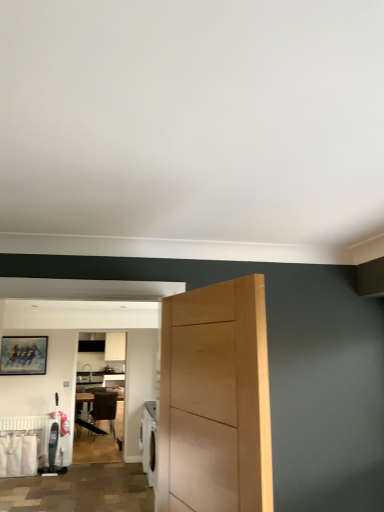
This screenshot has height=512, width=384. What do you see at coordinates (29, 428) in the screenshot?
I see `white matte radiator at lower left` at bounding box center [29, 428].

Where is `wooden table at center`? This screenshot has width=384, height=512. wooden table at center is located at coordinates (100, 409).

This screenshot has width=384, height=512. What do you see at coordinates (216, 399) in the screenshot?
I see `light wood door at center` at bounding box center [216, 399].

Looking at this image, measure the distance between point [106,402] and camera.

The depth of point [106,402] is 7.44 meters.

The width and height of the screenshot is (384, 512). What do you see at coordinates (105, 407) in the screenshot? I see `wooden chair at center` at bounding box center [105, 407].

The image size is (384, 512). Find the location of `white matte radiator at lower left`. white matte radiator at lower left is located at coordinates (29, 428).

Is wooden chair at center facing away from wooden table at center?

Yes, wooden chair at center's orientation is away from wooden table at center.

From the picture: Is wooden chair at center with wooden table at center?

Yes, wooden chair at center is with wooden table at center.

From a real-world perspective, which object stands above the other?

From a 3D spatial view, wooden chair at center is above.

Which object is positioned more to the left, light wood door at center or wooden chair at center?

Positioned to the left is wooden chair at center.

Is light wood door at center positioned beyond the bounds of wooden chair at center?

Yes, light wood door at center is outside of wooden chair at center.

Can you tell me how much light wood door at center and wooden chair at center differ in facing direction?

101 degrees.

From the picture: Is light wood door at center with wooden chair at center?

A: No, light wood door at center is not next to wooden chair at center.

Which of these two, wooden chair at center or white matte radiator at lower left, is thinner?

With smaller width is white matte radiator at lower left.

Which point is more distant from viewer, (x=103, y=411) or (x=47, y=434)?

The point (x=103, y=411) is farther.

Between wooden chair at center and white matte radiator at lower left, which one has larger size?

wooden chair at center.

Does white matte radiator at lower left have a lesser width compared to wooden table at center?

Indeed, white matte radiator at lower left has a lesser width compared to wooden table at center.

From a real-world perspective, which is physically above, white matte radiator at lower left or wooden table at center?

white matte radiator at lower left is physically above.

Which object is positioned more to the right, white matte radiator at lower left or wooden table at center?

wooden table at center.

At what (x,y) coordinates should I click in order to perform the action: click on table below the white matte radiator at lower left (from a real-world perspective). Please return your answer as a coordinate pair (x, y). Looking at the image, I should click on (100, 409).

Image resolution: width=384 pixels, height=512 pixels. In order to click on door on the right of white matte radiator at lower left in this screenshot , I will do `click(216, 399)`.

Is light wood door at center bigger than white matte radiator at lower left?

Yes, light wood door at center is bigger than white matte radiator at lower left.

Considering the positions of points (206, 425) and (11, 417), is point (206, 425) closer to camera compared to point (11, 417)?

That is True.

From the image's perspective, who appears lower, wooden table at center or white matte radiator at lower left?

wooden table at center is shown below in the image.

Is wooden table at center situated inside white matte radiator at lower left or outside?

wooden table at center exists outside the volume of white matte radiator at lower left.

What's the angular difference between wooden table at center and white matte radiator at lower left's facing directions?

wooden table at center and white matte radiator at lower left are facing 3.27 degrees away from each other.

Between wooden table at center and white matte radiator at lower left, which one is positioned in front?

white matte radiator at lower left is in front.

Is white matte radiator at lower left turned away from light wood door at center?

No, white matte radiator at lower left is not facing away from light wood door at center.

From the image's perspective, is white matte radiator at lower left located beneath light wood door at center?

Indeed, from the image's perspective, white matte radiator at lower left is shown beneath light wood door at center.

Is white matte radiator at lower left at the left side of light wood door at center?

Yes.

Find the location of a particular element. table behind the wooden chair at center is located at coordinates (100, 409).

Image resolution: width=384 pixels, height=512 pixels. In order to click on chair below the light wood door at center (from a real-world perspective) in this screenshot , I will do `click(105, 407)`.

Looking at the image, which one is located closer to wooden table at center, wooden chair at center or light wood door at center?

wooden chair at center lies closer to wooden table at center than the other object.

Based on their spatial positions, is light wood door at center or wooden table at center further from white matte radiator at lower left?

light wood door at center lies further to white matte radiator at lower left than the other object.

From the image, which object appears to be farther from wooden chair at center, wooden table at center or light wood door at center?

light wood door at center.

Based on their spatial positions, is wooden table at center or white matte radiator at lower left closer to wooden chair at center?

The object closer to wooden chair at center is wooden table at center.

From the image, which object appears to be farther from wooden table at center, light wood door at center or white matte radiator at lower left?

Among the two, light wood door at center is located further to wooden table at center.

From the picture: Estimate the real-world distances between objects in this image. Which object is further from wooden chair at center, white matte radiator at lower left or light wood door at center?

Based on the image, light wood door at center appears to be further to wooden chair at center.

When comparing their distances from wooden table at center, does light wood door at center or wooden chair at center seem further?

light wood door at center lies further to wooden table at center than the other object.

Consider the image. Based on their spatial positions, is wooden chair at center or white matte radiator at lower left further from light wood door at center?

Based on the image, wooden chair at center appears to be further to light wood door at center.

I want to click on chair positioned between white matte radiator at lower left and wooden table at center from near to far, so click(105, 407).

You are a GUI agent. You are given a task and a screenshot of the screen. Output one action in this format:
    pyautogui.click(x=<x>, y=<y>)
    Task: Click on the radiator between light wood door at center and wooden chair at center from front to back
    Image resolution: width=384 pixels, height=512 pixels.
    Given the screenshot: What is the action you would take?
    pyautogui.click(x=29, y=428)

Locate an element on the screen. The height and width of the screenshot is (512, 384). radiator positioned between light wood door at center and wooden table at center from near to far is located at coordinates (29, 428).

The width and height of the screenshot is (384, 512). Find the location of `chair positioned between light wood door at center and wooden table at center from near to far`. chair positioned between light wood door at center and wooden table at center from near to far is located at coordinates click(105, 407).